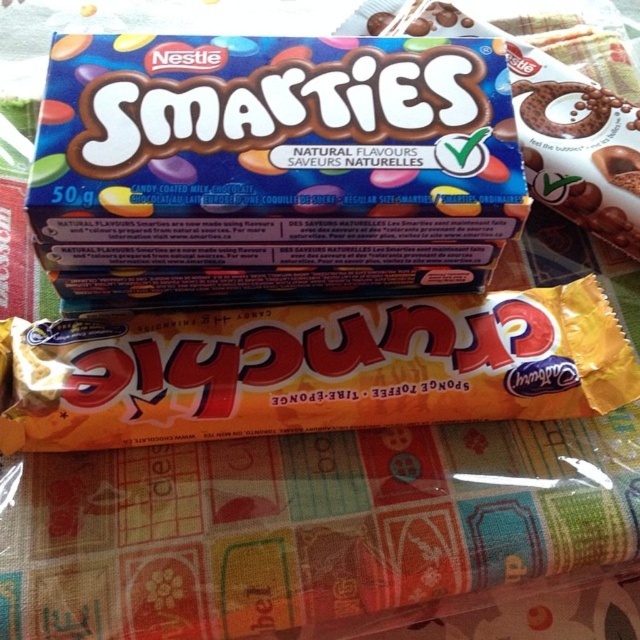
Question: Which of the following is the closest to the observer?

Choices:
 (A) (637, 193)
 (B) (76, 243)

Answer: (B)

Question: Can you confirm if matte chocolate smarties at upper center is bigger than yellow sponge toffee at center?

Choices:
 (A) no
 (B) yes

Answer: (B)

Question: Can you confirm if matte chocolate smarties at upper center is positioned above smooth chocolate bar at center?

Choices:
 (A) yes
 (B) no

Answer: (B)

Question: Does matte chocolate smarties at upper center have a lesser width compared to yellow sponge toffee at center?

Choices:
 (A) no
 (B) yes

Answer: (B)

Question: Which point is farther to the camera?

Choices:
 (A) smooth chocolate bar at center
 (B) yellow sponge toffee at center
 (C) matte chocolate smarties at upper center

Answer: (A)

Question: Which point is farther from the camera taking this photo?

Choices:
 (A) (538, 108)
 (B) (368, 86)
 (C) (369, 392)

Answer: (A)